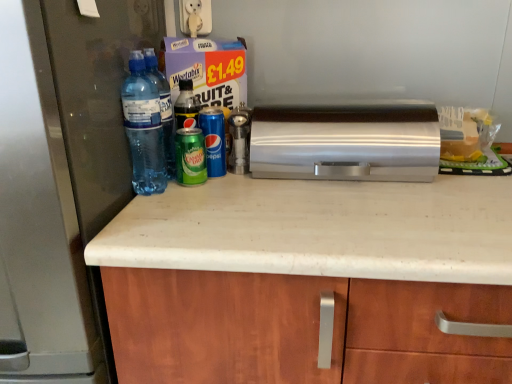
What do you see at coordinates (214, 140) in the screenshot?
I see `blue metallic can at center, positioned as the third bottle in left-to-right order` at bounding box center [214, 140].

Identify the location of transparent plastic water bottles at left, the 1th bottle positioned from the left. The image size is (512, 384). (144, 128).

Find the location of a particular element. The height and width of the screenshot is (384, 512). green matte can at center is located at coordinates pyautogui.click(x=190, y=157).

Where is `metallic silver shaker at center`? Image resolution: width=512 pixels, height=384 pixels. metallic silver shaker at center is located at coordinates (239, 139).

Locate an element on the screen. The width and height of the screenshot is (512, 384). matte black refrigerator at left is located at coordinates (61, 177).

Is silver metallic bread bin at center at the right side of green matte can at center, the second bottle when ordered from left to right?

Indeed, silver metallic bread bin at center is positioned on the right side of green matte can at center, the second bottle when ordered from left to right.

How different are the orientations of silver metallic bread bin at center and green matte can at center, arranged as the 2th bottle when viewed from the right, in degrees?

There is a 0.00106-degree angle between the facing directions of silver metallic bread bin at center and green matte can at center, arranged as the 2th bottle when viewed from the right.

Is point (350, 144) closer or farther from the camera than point (177, 118)?

Clearly, point (350, 144) is closer to the camera than point (177, 118).

Considering the relative sizes of blue metallic can at center, positioned as the third bottle in left-to-right order, and transparent plastic water bottles at left, which is the third bottle from right to left, in the image provided, is blue metallic can at center, positioned as the third bottle in left-to-right order, taller than transparent plastic water bottles at left, which is the third bottle from right to left,?

Incorrect, the height of blue metallic can at center, positioned as the third bottle in left-to-right order, is not larger of that of transparent plastic water bottles at left, which is the third bottle from right to left.

Is transparent plastic water bottles at left, which is the third bottle from right to left, located within blue metallic can at center, which is counted as the first bottle, starting from the right?

No.

Between blue metallic can at center, positioned as the third bottle in left-to-right order, and transparent plastic water bottles at left, which is the third bottle from right to left, which one has smaller size?

blue metallic can at center, positioned as the third bottle in left-to-right order, is smaller.

From the image's perspective, relative to transparent plastic water bottles at left, the 1th bottle positioned from the left, is blue metallic can at center, which is counted as the first bottle, starting from the right, above or below?

Based on their image positions, blue metallic can at center, which is counted as the first bottle, starting from the right, is located beneath transparent plastic water bottles at left, the 1th bottle positioned from the left.

Which is in front, point (180, 84) or point (234, 146)?

The point (180, 84) is closer.

Considering the sizes of objects green matte can at center, arranged as the 2th bottle when viewed from the right, and metallic silver shaker at center in the image provided, who is wider, green matte can at center, arranged as the 2th bottle when viewed from the right, or metallic silver shaker at center?

With larger width is green matte can at center, arranged as the 2th bottle when viewed from the right.

Looking at this image, is metallic silver shaker at center located within green matte can at center, arranged as the 2th bottle when viewed from the right?

That's incorrect, metallic silver shaker at center is not inside green matte can at center, arranged as the 2th bottle when viewed from the right.

From the image's perspective, who appears lower, green matte can at center, arranged as the 2th bottle when viewed from the right, or metallic silver shaker at center?

metallic silver shaker at center, from the image's perspective.

Does point (192, 92) come closer to viewer compared to point (332, 156)?

No, it is not.

From a real-world perspective, between green matte can at center, the second bottle when ordered from left to right, and silver metallic bread bin at center, who is vertically lower?

silver metallic bread bin at center, from a real-world perspective.

In the image, is green matte can at center, arranged as the 2th bottle when viewed from the right, positioned in front of or behind silver metallic bread bin at center?

In the image, green matte can at center, arranged as the 2th bottle when viewed from the right, appears behind silver metallic bread bin at center.

Considering the relative sizes of green matte can at center, the second bottle when ordered from left to right, and silver metallic bread bin at center in the image provided, is green matte can at center, the second bottle when ordered from left to right, wider than silver metallic bread bin at center?

No, green matte can at center, the second bottle when ordered from left to right, is not wider than silver metallic bread bin at center.

The height and width of the screenshot is (384, 512). What are the coordinates of `home appliance that is in front of the metallic silver shaker at center` in the screenshot? It's located at (346, 142).

Based on the photo, looking at the image, does metallic silver shaker at center seem bigger or smaller compared to silver metallic bread bin at center?

Considering their sizes, metallic silver shaker at center takes up less space than silver metallic bread bin at center.

Is metallic silver shaker at center taller or shorter than silver metallic bread bin at center?

Considering their sizes, metallic silver shaker at center has more height than silver metallic bread bin at center.

Looking at their sizes, would you say transparent plastic water bottles at left, the 1th bottle positioned from the left, is wider or thinner than green matte can at center, the second bottle when ordered from left to right?

In the image, transparent plastic water bottles at left, the 1th bottle positioned from the left, appears to be wider than green matte can at center, the second bottle when ordered from left to right.

How many degrees apart are the facing directions of transparent plastic water bottles at left, which is the third bottle from right to left, and green matte can at center, arranged as the 2th bottle when viewed from the right?

0.00462 degrees separate the facing orientations of transparent plastic water bottles at left, which is the third bottle from right to left, and green matte can at center, arranged as the 2th bottle when viewed from the right.

Is the surface of transparent plastic water bottles at left, the 1th bottle positioned from the left, in direct contact with green matte can at center, the second bottle when ordered from left to right?

No, transparent plastic water bottles at left, the 1th bottle positioned from the left, is not in contact with green matte can at center, the second bottle when ordered from left to right.

In terms of height, does transparent plastic water bottles at left, the 1th bottle positioned from the left, look taller or shorter compared to green matte can at center, arranged as the 2th bottle when viewed from the right?

transparent plastic water bottles at left, the 1th bottle positioned from the left, is taller than green matte can at center, arranged as the 2th bottle when viewed from the right.

In terms of height, does green matte can at center, the second bottle when ordered from left to right, look taller or shorter compared to transparent plastic water bottles at left, which is the third bottle from right to left?

Considering their sizes, green matte can at center, the second bottle when ordered from left to right, has less height than transparent plastic water bottles at left, which is the third bottle from right to left.

Could you tell me if green matte can at center, arranged as the 2th bottle when viewed from the right, is turned towards transparent plastic water bottles at left, the 1th bottle positioned from the left?

No, green matte can at center, arranged as the 2th bottle when viewed from the right, is not facing towards transparent plastic water bottles at left, the 1th bottle positioned from the left.

Could transparent plastic water bottles at left, which is the third bottle from right to left, be considered to be inside green matte can at center, arranged as the 2th bottle when viewed from the right?

No, transparent plastic water bottles at left, which is the third bottle from right to left, is not a part of green matte can at center, arranged as the 2th bottle when viewed from the right.

Locate an element on the screen. This screenshot has width=512, height=384. home appliance below the green matte can at center, the second bottle when ordered from left to right (from a real-world perspective) is located at coordinates (346, 142).

The width and height of the screenshot is (512, 384). I want to click on the 1st bottle behind the transparent plastic water bottles at left, the 1th bottle positioned from the left, so click(214, 140).

Based on their spatial positions, is silver metallic bread bin at center or transparent plastic water bottles at left, the 1th bottle positioned from the left, closer to green matte can at center, arranged as the 2th bottle when viewed from the right?

transparent plastic water bottles at left, the 1th bottle positioned from the left.

Estimate the real-world distances between objects in this image. Which object is closer to silver metallic bread bin at center, green matte can at center, the second bottle when ordered from left to right, or blue metallic can at center, positioned as the third bottle in left-to-right order?

The object closer to silver metallic bread bin at center is blue metallic can at center, positioned as the third bottle in left-to-right order.

From the image, which object appears to be farther from metallic silver shaker at center, transparent plastic water bottles at left, the 1th bottle positioned from the left, or green matte can at center, the second bottle when ordered from left to right?

The object further to metallic silver shaker at center is transparent plastic water bottles at left, the 1th bottle positioned from the left.

Considering their positions, is silver metallic bread bin at center positioned closer to blue metallic can at center, positioned as the third bottle in left-to-right order, than transparent plastic water bottles at left, which is the third bottle from right to left?

The object closer to blue metallic can at center, positioned as the third bottle in left-to-right order, is transparent plastic water bottles at left, which is the third bottle from right to left.

Looking at the image, which one is located further to green matte can at center, the second bottle when ordered from left to right, transparent plastic water bottles at left, which is the third bottle from right to left, or green matte can at center?

Based on the image, transparent plastic water bottles at left, which is the third bottle from right to left, appears to be further to green matte can at center, the second bottle when ordered from left to right.

Looking at the image, which one is located closer to silver metallic bread bin at center, blue metallic can at center, positioned as the third bottle in left-to-right order, or metallic silver shaker at center?

metallic silver shaker at center.

Which object lies nearer to the anchor point metallic silver shaker at center, silver metallic bread bin at center or blue metallic can at center, which is counted as the first bottle, starting from the right?

blue metallic can at center, which is counted as the first bottle, starting from the right, is positioned closer to the anchor metallic silver shaker at center.

When comparing their distances from blue metallic can at center, positioned as the third bottle in left-to-right order, does metallic silver shaker at center or green matte can at center seem closer?

green matte can at center is closer to blue metallic can at center, positioned as the third bottle in left-to-right order.

You are a GUI agent. You are given a task and a screenshot of the screen. Output one action in this format:
    pyautogui.click(x=<x>, y=<y>)
    Task: Click on the beverage located between green matte can at center, arranged as the 2th bottle when viewed from the right, and silver metallic bread bin at center in the left-right direction
    This screenshot has height=384, width=512.
    Given the screenshot: What is the action you would take?
    pyautogui.click(x=190, y=157)

Image resolution: width=512 pixels, height=384 pixels. Identify the location of appliance between matte black refrigerator at left and silver metallic bread bin at center. (239, 139).

Locate an element on the screen. beverage located between matte black refrigerator at left and blue metallic can at center, which is counted as the first bottle, starting from the right, in the left-right direction is located at coordinates (190, 157).

Where is `beverage between matte black refrigerator at left and metallic silver shaker at center from left to right`? beverage between matte black refrigerator at left and metallic silver shaker at center from left to right is located at coordinates (190, 157).